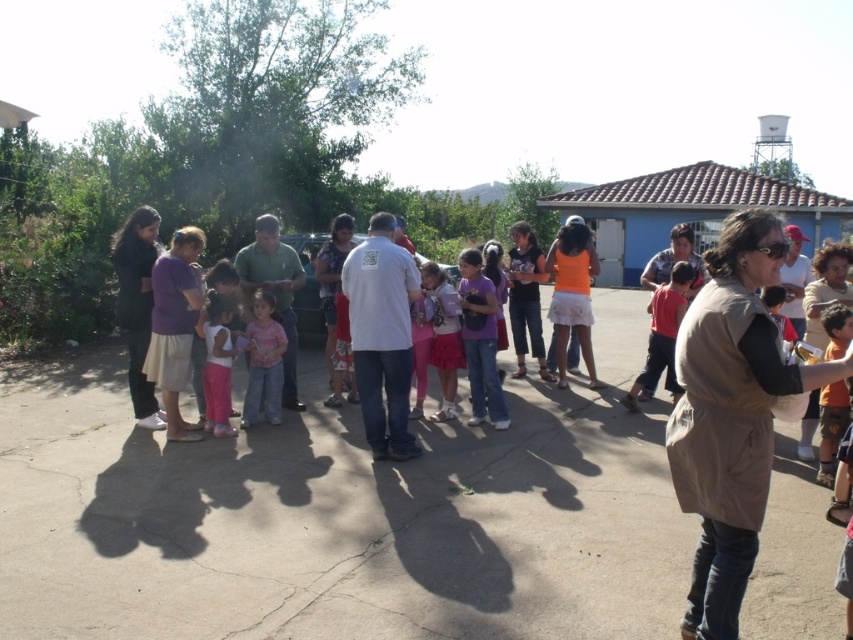
You are standing at the point labeled as point (259,317) and want to move towards the point labeled as point (624,396). Based on the scene description, will you be moving forward or backward relative to your current position?

Since point (624,396) is behind point (259,317), moving towards it would mean moving backward relative to your current position at point (259,317).

You are organizing a group photo for the event and need to ensure there is enough space between the red cotton shirt at center and the pink cotton shirt at center. The minimum required distance for the photo setup is 12 feet. Can these two individuals be positioned appropriately?

The red cotton shirt at center and pink cotton shirt at center are 13.42 feet apart, which exceeds the minimum required distance of 12 feet. Therefore, they can be positioned appropriately for the group photo setup.

You are organizing a clothing donation drive and need to categorize items based on their size. You have two items to sort today. The first is a black fabric jacket at left, and the second is a matte green shirt at center. Which of these two items is narrower in width?

The black fabric jacket at left is narrower in width than the matte green shirt at center.